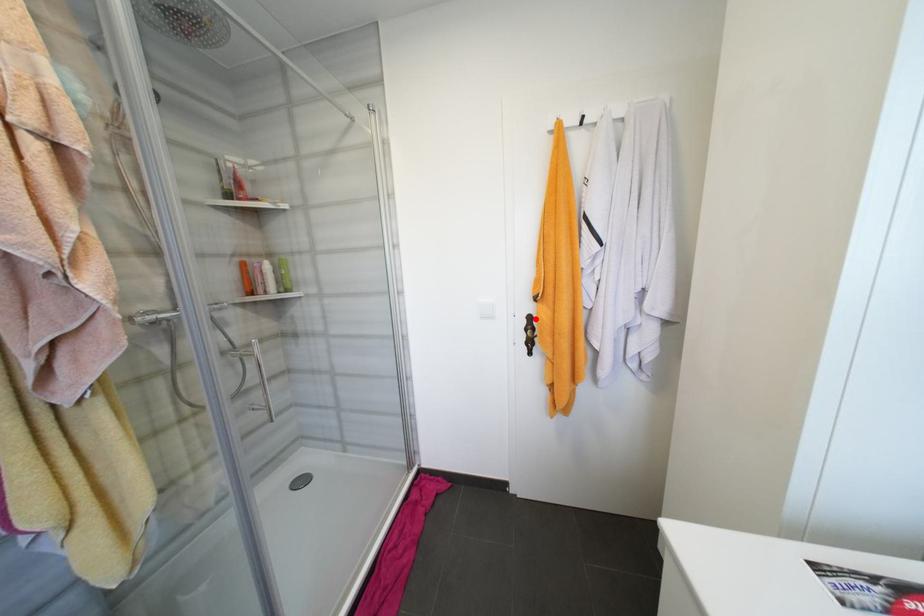
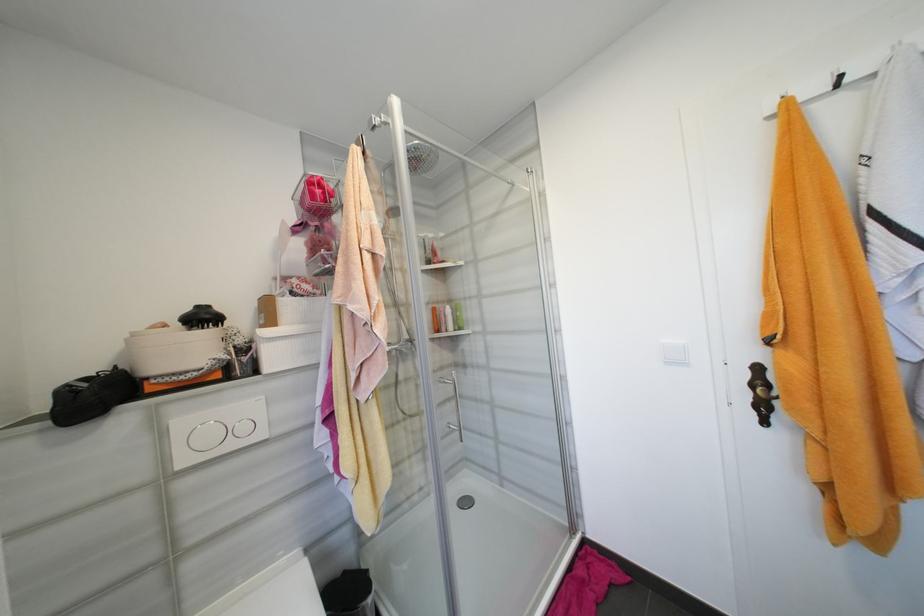
Locate, in the second image, the point that corresponds to the highlighted location in the first image.

(763, 370)